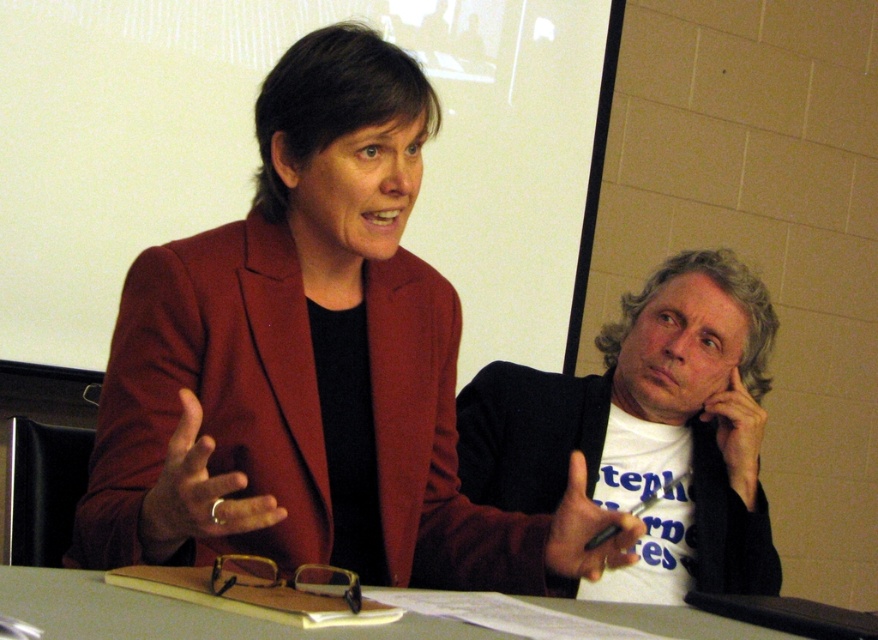
Question: Observing the image, what is the correct spatial positioning of white cotton t-shirt at right in reference to gray matte table at center?

Choices:
 (A) left
 (B) right

Answer: (B)

Question: Which of these objects is positioned farthest from the black matte pen at center?

Choices:
 (A) matte red jacket at center
 (B) gray matte table at center

Answer: (A)

Question: Is gray matte table at center smaller than black matte pen at center?

Choices:
 (A) no
 (B) yes

Answer: (A)

Question: Which point is farther to the camera?

Choices:
 (A) (196, 554)
 (B) (411, 625)

Answer: (A)

Question: Does white cotton t-shirt at right appear over gray matte table at center?

Choices:
 (A) no
 (B) yes

Answer: (B)

Question: Which point is closer to the camera taking this photo?

Choices:
 (A) (231, 506)
 (B) (768, 634)
 (C) (687, 365)

Answer: (A)